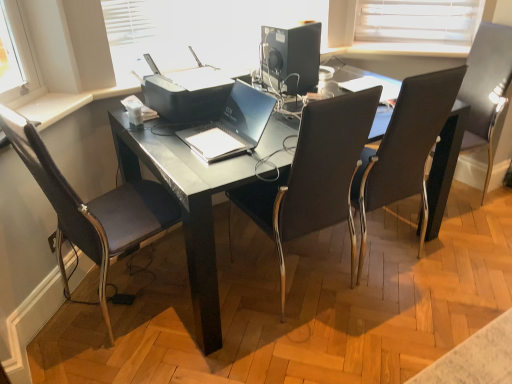
Where is `free point below satin black laptop at center (from a real-world perspective)`? The image size is (512, 384). free point below satin black laptop at center (from a real-world perspective) is located at coordinates (215, 140).